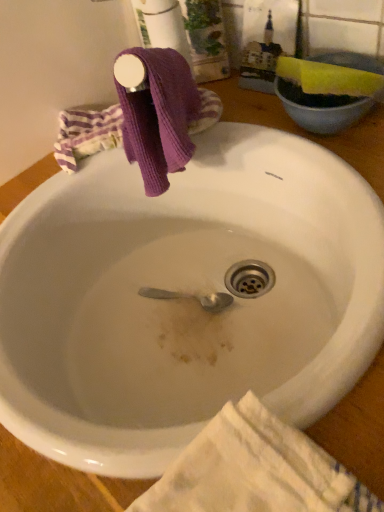
Based on the photo, what is the approximate width of white glossy sink at upper center?

white glossy sink at upper center is 18.24 inches in width.

Describe the element at coordinates (160, 237) in the screenshot. I see `white glossy sink at upper center` at that location.

Image resolution: width=384 pixels, height=512 pixels. Find the location of `white glossy sink at upper center`. white glossy sink at upper center is located at coordinates (160, 237).

In order to click on white textured towel at lower right in this screenshot , I will do `click(255, 470)`.

What do you see at coordinates (255, 470) in the screenshot? I see `white textured towel at lower right` at bounding box center [255, 470].

Where is `white glossy sink at upper center`? Image resolution: width=384 pixels, height=512 pixels. white glossy sink at upper center is located at coordinates (160, 237).

Is white glossy sink at upper center to the left or to the right of white textured towel at lower right in the image?

From the image, it's evident that white glossy sink at upper center is to the left of white textured towel at lower right.

Is white glossy sink at upper center further to camera compared to white textured towel at lower right?

Yes, white glossy sink at upper center is behind white textured towel at lower right.

Does point (188, 424) appear closer or farther from the camera than point (295, 445)?

Point (188, 424).

From the image's perspective, is white glossy sink at upper center above white textured towel at lower right?

Indeed, from the image's perspective, white glossy sink at upper center is shown above white textured towel at lower right.

From a real-world perspective, who is located higher, white glossy sink at upper center or white textured towel at lower right?

In real-world perspective, white textured towel at lower right is above.

Considering the relative sizes of white glossy sink at upper center and white textured towel at lower right in the image provided, is white glossy sink at upper center wider than white textured towel at lower right?

Correct, the width of white glossy sink at upper center exceeds that of white textured towel at lower right.

Considering the relative sizes of white glossy sink at upper center and white textured towel at lower right in the image provided, is white glossy sink at upper center taller than white textured towel at lower right?

Yes.

Which of these two, white glossy sink at upper center or white textured towel at lower right, is bigger?

Bigger between the two is white glossy sink at upper center.

Consider the image. Would you say white textured towel at lower right is part of white glossy sink at upper center's contents?

Actually, white textured towel at lower right is outside white glossy sink at upper center.

Is white glossy sink at upper center not near white textured towel at lower right?

white glossy sink at upper center is actually quite close to white textured towel at lower right.

Is white glossy sink at upper center facing towards white textured towel at lower right?

No, white glossy sink at upper center is not aimed at white textured towel at lower right.

How different are the orientations of white glossy sink at upper center and white textured towel at lower right in degrees?

1.16 degrees.

Image resolution: width=384 pixels, height=512 pixels. Find the location of `sink located above the white textured towel at lower right (from the image's perspective)`. sink located above the white textured towel at lower right (from the image's perspective) is located at coordinates (160, 237).

Which object is positioned more to the left, white textured towel at lower right or white glossy sink at upper center?

From the viewer's perspective, white glossy sink at upper center appears more on the left side.

Looking at this image, is white textured towel at lower right in front of white glossy sink at upper center?

That is True.

Considering the positions of points (230, 479) and (125, 466), is point (230, 479) farther from camera compared to point (125, 466)?

No, (230, 479) is in front of (125, 466).

From the image's perspective, which one is positioned lower, white textured towel at lower right or white glossy sink at upper center?

white textured towel at lower right is shown below in the image.

Based on the photo, from a real-world perspective, which object stands above the other?

In real-world perspective, white textured towel at lower right is above.

Is white textured towel at lower right wider than white glossy sink at upper center?

In fact, white textured towel at lower right might be narrower than white glossy sink at upper center.

From their relative heights in the image, would you say white textured towel at lower right is taller or shorter than white glossy sink at upper center?

Considering their sizes, white textured towel at lower right has less height than white glossy sink at upper center.

Considering the relative sizes of white textured towel at lower right and white glossy sink at upper center in the image provided, is white textured towel at lower right smaller than white glossy sink at upper center?

Indeed, white textured towel at lower right has a smaller size compared to white glossy sink at upper center.

Is white textured towel at lower right surrounding white glossy sink at upper center?

No, white glossy sink at upper center is not surrounded by white textured towel at lower right.

Can you see white textured towel at lower right touching white glossy sink at upper center?

white textured towel at lower right and white glossy sink at upper center are not in contact.

Could you tell me if white textured towel at lower right is turned towards white glossy sink at upper center?

Yes, white textured towel at lower right faces towards white glossy sink at upper center.

Image resolution: width=384 pixels, height=512 pixels. Identify the location of beach towel below the white glossy sink at upper center (from the image's perspective). (255, 470).

This screenshot has height=512, width=384. What are the coordinates of `sink lying behind the white textured towel at lower right` in the screenshot? It's located at (160, 237).

Locate an element on the screen. beach towel on the right of white glossy sink at upper center is located at coordinates (255, 470).